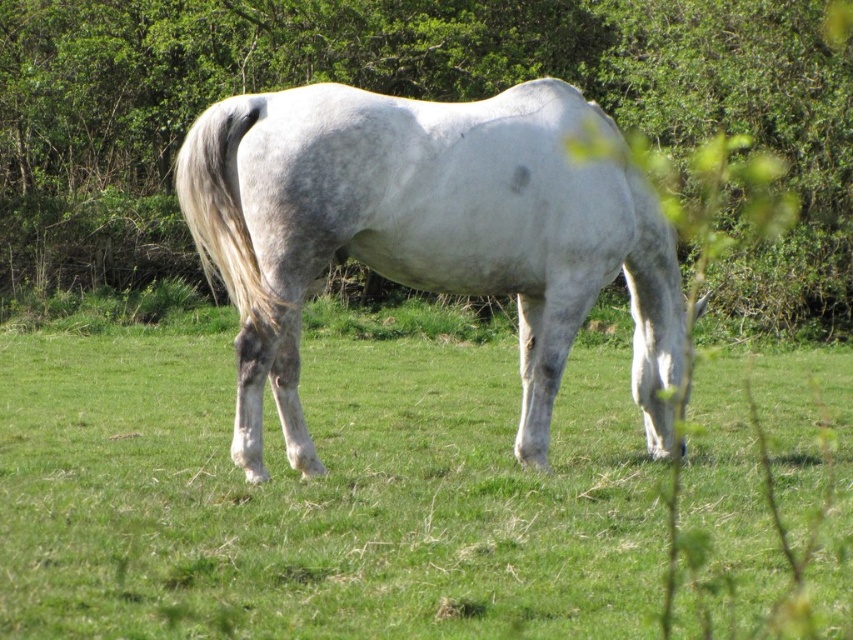
Does point (543, 26) lie in front of point (416, 129)?

That is False.

Consider the image. Can you confirm if green leafy tree at center is smaller than white matte horse at center?

No, green leafy tree at center is not smaller than white matte horse at center.

Is point (32, 248) positioned after point (555, 228)?

Yes, it is behind point (555, 228).

Where is `green leafy tree at center`? Image resolution: width=853 pixels, height=640 pixels. green leafy tree at center is located at coordinates (410, 96).

Between green grass at center and white matte horse at center, which one has more height?

With more height is white matte horse at center.

Is point (527, 577) closer to viewer compared to point (550, 339)?

Yes, it is in front of point (550, 339).

This screenshot has height=640, width=853. Identify the location of green grass at center. (x=317, y=496).

Between green grass at center and green leafy tree at center, which one appears on the left side from the viewer's perspective?

green leafy tree at center

Does green grass at center have a larger size compared to green leafy tree at center?

Incorrect, green grass at center is not larger than green leafy tree at center.

Locate an element on the screen. This screenshot has width=853, height=640. green grass at center is located at coordinates (317, 496).